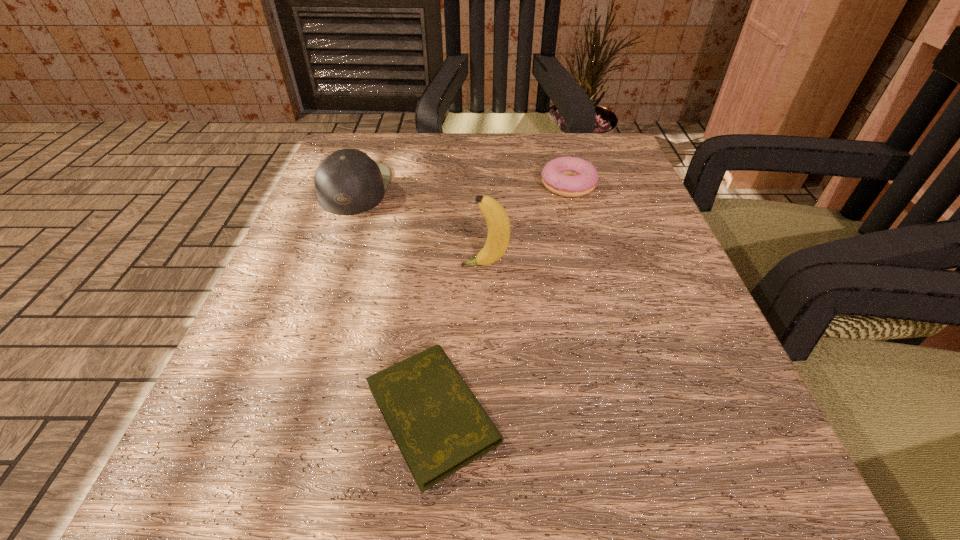
The width and height of the screenshot is (960, 540). I want to click on vacant space located from the stem of the third farthest object, so click(424, 265).

The height and width of the screenshot is (540, 960). I want to click on blank area located 0.200m on the brim of the cap, so click(x=491, y=188).

At what (x,y) coordinates should I click in order to perform the action: click on free region located 0.290m on the left of the doughnut. Please return your answer as a coordinate pair (x, y). This screenshot has width=960, height=540. Looking at the image, I should click on (394, 185).

In order to click on vacant space located on the right of the diary in this screenshot , I will do `click(757, 414)`.

Locate an element on the screen. This screenshot has width=960, height=540. cap at the far edge is located at coordinates (348, 182).

You are a GUI agent. You are given a task and a screenshot of the screen. Output one action in this format:
    pyautogui.click(x=<x>, y=<y>)
    Task: Click on the doughnut at the far edge
    
    Given the screenshot: What is the action you would take?
    pyautogui.click(x=567, y=176)

This screenshot has height=540, width=960. I want to click on object at the near edge, so click(x=440, y=427).

This screenshot has height=540, width=960. I want to click on object present at the left edge, so click(348, 182).

Identify the location of object that is at the right edge. (567, 176).

In order to click on object that is positioned at the far left corner in this screenshot , I will do `click(348, 182)`.